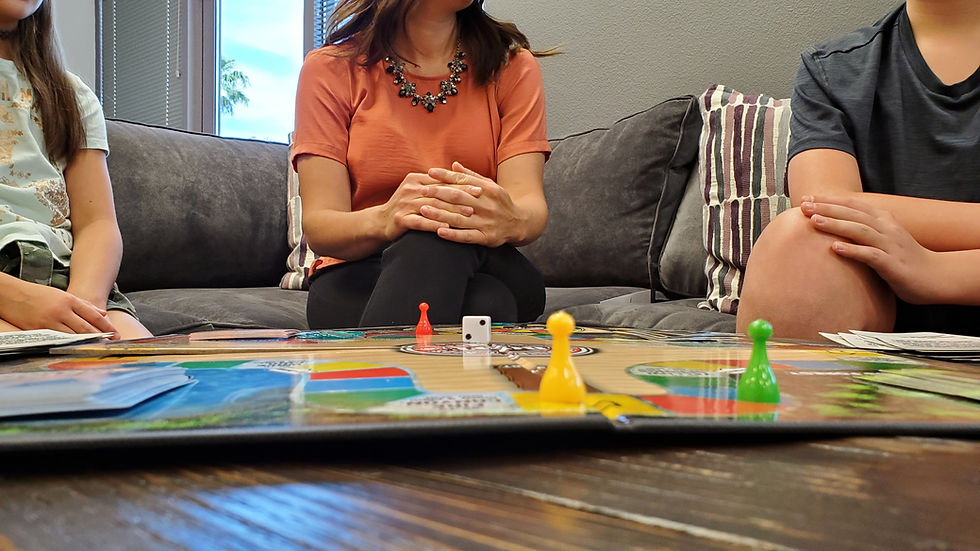
You are a GUI agent. You are given a task and a screenshot of the screen. Output one action in this format:
    pyautogui.click(x=<x>, y=<y>)
    Task: Click on the cushion/pillow
    Image resolution: width=980 pixels, height=551 pixels.
    Given the screenshot: What is the action you would take?
    pyautogui.click(x=655, y=192), pyautogui.click(x=686, y=233), pyautogui.click(x=744, y=179), pyautogui.click(x=179, y=192)